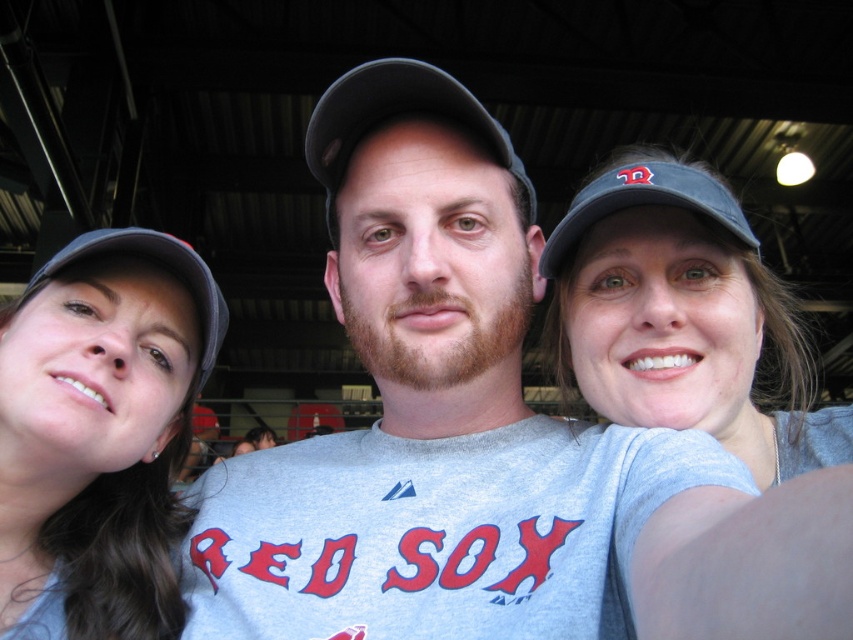
You are standing at the origin point in the image. The gray matte baseball cap at center is located at coordinates point (432, 413). If you want to move towards the gray matte baseball cap at center, which direction should you move?

The gray matte baseball cap at center is located at point (432, 413), so you should move northeast to reach it.

You are a photographer at a baseball stadium. You need to adjust the camera angle to ensure both the gray matte baseball cap at center and the gray fabric cap at upper left are fully visible. Which cap requires you to adjust the camera angle more due to its height?

The gray matte baseball cap at center requires more adjustment because it is much taller than the gray fabric cap at upper left, so the camera angle needs to be raised higher to capture its full height without cutting off the top.